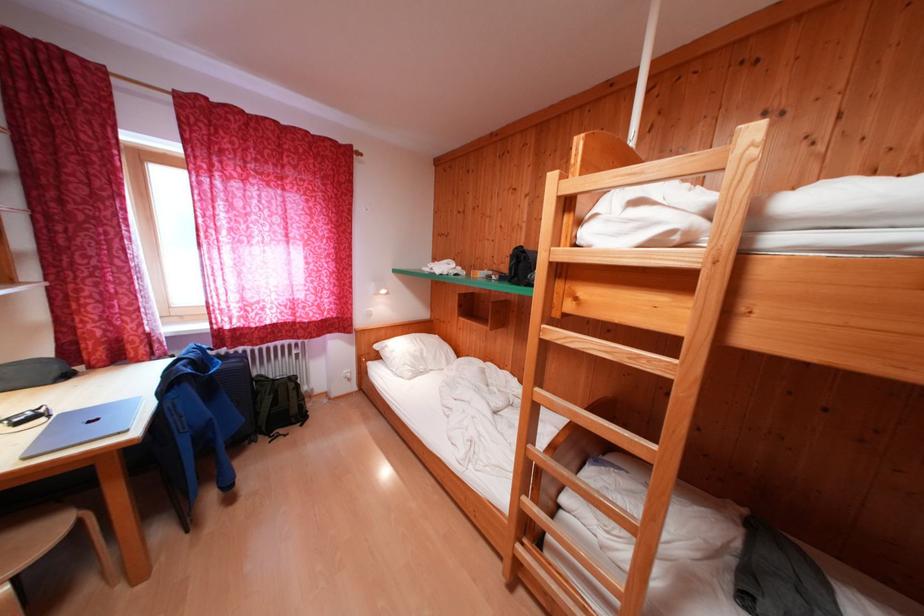
Describe the element at coordinates (200, 317) in the screenshot. I see `the window handle` at that location.